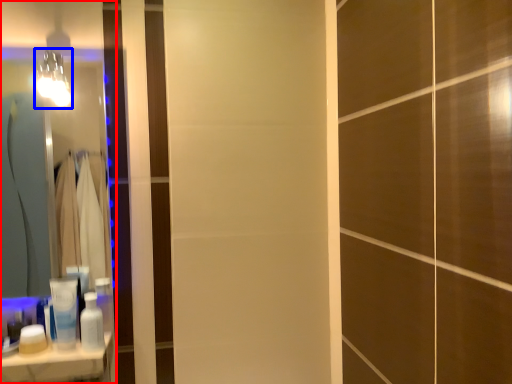
Question: Which of the following is the farthest to the observer, mirror (highlighted by a red box) or light fixture (highlighted by a blue box)?

Choices:
 (A) mirror
 (B) light fixture

Answer: (A)